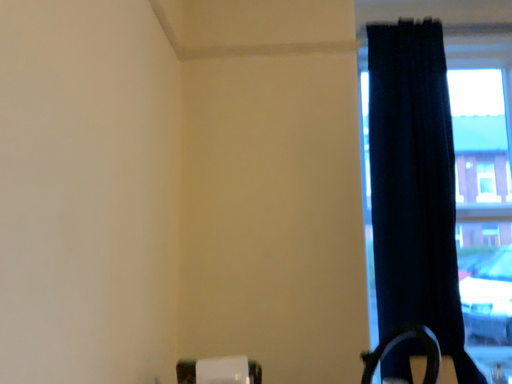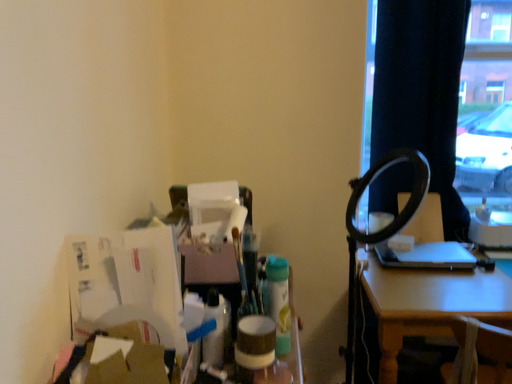
Question: Which way did the camera rotate in the video?

Choices:
 (A) rotated downward
 (B) rotated upward

Answer: (A)